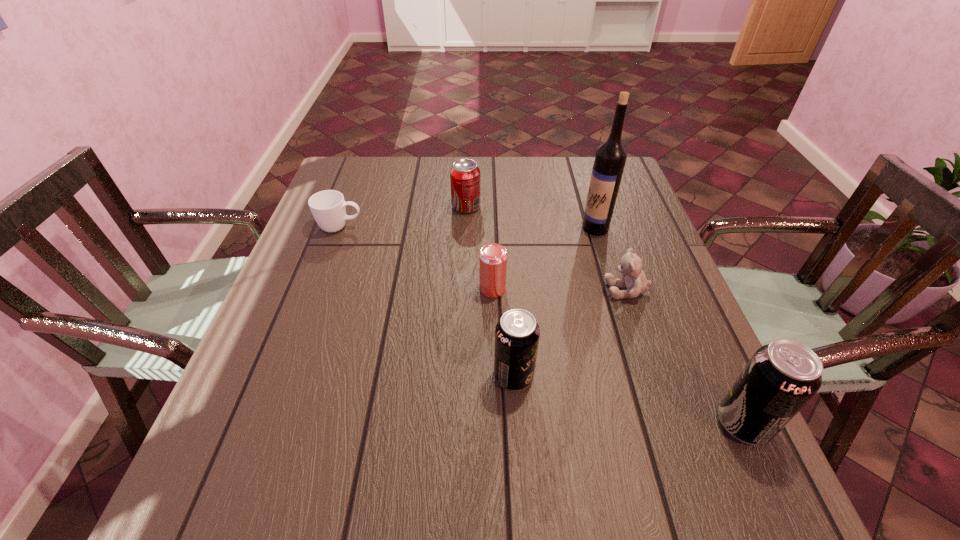
Identify the location of unoccupied position between the tallest soda can and the leftmost object. The image size is (960, 540). (541, 326).

Identify which object is located as the fourth nearest to the farthest object. Please provide its 2D coordinates. Your answer should be formatted as a tuple, i.e. [(x, y)], where the tuple contains the x and y coordinates of a point satisfying the conditions above.

[(630, 266)]

What are the coordinates of `object that stands as the closest to the beer can` in the screenshot? It's located at (517, 333).

Identify which soda can is the second nearest to the teddy bear. Please provide its 2D coordinates. Your answer should be formatted as a tuple, i.e. [(x, y)], where the tuple contains the x and y coordinates of a point satisfying the conditions above.

[(780, 378)]

Image resolution: width=960 pixels, height=540 pixels. I want to click on soda can that is the nearest to the nearest object, so click(517, 333).

The width and height of the screenshot is (960, 540). In order to click on free space that satisfies the following two spatial constraints: 1. with the handle on the side of the cup; 2. on the left side of the tallest soda can in this screenshot , I will do `click(268, 423)`.

You are a GUI agent. You are given a task and a screenshot of the screen. Output one action in this format:
    pyautogui.click(x=<x>, y=<y>)
    Task: Click on the vacant space that satisfies the following two spatial constraints: 1. on the label of the rightmost soda can; 2. on the right side of the tallest object
    
    Given the screenshot: What is the action you would take?
    pyautogui.click(x=655, y=423)

Locate an element on the screen. This screenshot has height=540, width=960. vacant position in the image that satisfies the following two spatial constraints: 1. on the face of the teddy bear; 2. on the left side of the nearest soda can is located at coordinates (672, 423).

Locate an element on the screen. free space that satisfies the following two spatial constraints: 1. on the front side of the beer can; 2. on the right side of the rightmost soda can is located at coordinates (496, 423).